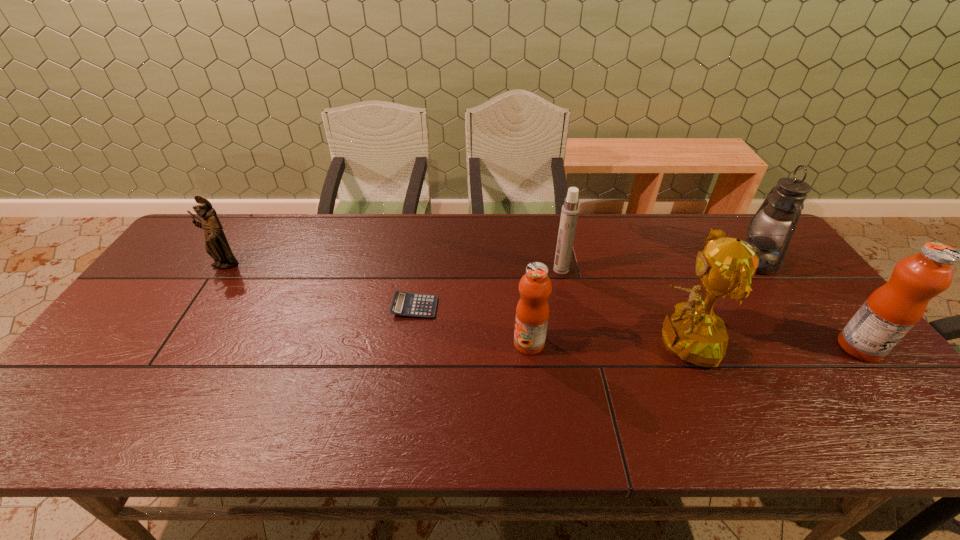
Where is `the shorter fruit juice`? The height and width of the screenshot is (540, 960). the shorter fruit juice is located at coordinates (532, 312).

The width and height of the screenshot is (960, 540). I want to click on the fifth object from right to left, so click(x=532, y=312).

This screenshot has height=540, width=960. In order to click on the taller fruit juice in this screenshot , I will do `click(890, 312)`.

Locate an element on the screen. Image resolution: width=960 pixels, height=540 pixels. aerosol can is located at coordinates (569, 215).

Locate an element on the screen. Image resolution: width=960 pixels, height=540 pixels. calculator is located at coordinates (403, 304).

This screenshot has height=540, width=960. Identify the location of the second object from left to right. (403, 304).

Where is `oil lamp`? This screenshot has width=960, height=540. oil lamp is located at coordinates (774, 223).

The height and width of the screenshot is (540, 960). In order to click on award in this screenshot , I will do `click(694, 333)`.

Image resolution: width=960 pixels, height=540 pixels. What are the coordinates of `figurine` in the screenshot? It's located at (216, 245).

At what (x,y) coordinates should I click in order to perform the action: click on vacant region located on the front label of the shorter fruit juice. Please return your answer as a coordinate pair (x, y). The width and height of the screenshot is (960, 540). Looking at the image, I should click on (360, 343).